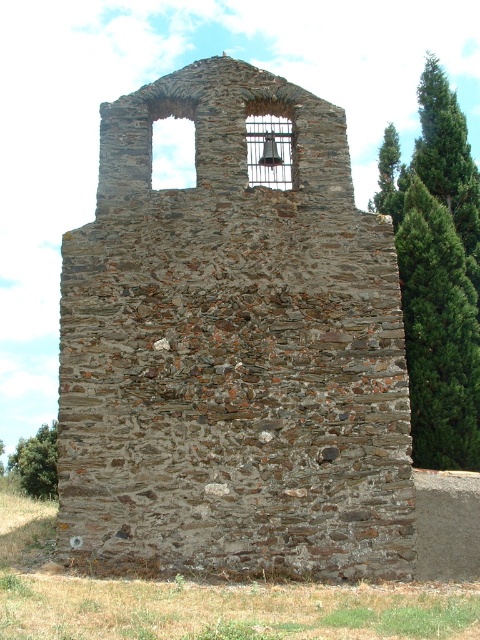
Question: Is green leafy tree at right to the right of metallic bell at upper center from the viewer's perspective?

Choices:
 (A) no
 (B) yes

Answer: (B)

Question: Does metallic bell at upper center have a larger size compared to green textured tree at right?

Choices:
 (A) no
 (B) yes

Answer: (A)

Question: Which point is closer to the camera?

Choices:
 (A) green leafy tree at right
 (B) brown stone bell tower at upper center
 (C) green leafy tree at lower left

Answer: (B)

Question: Estimate the real-world distances between objects in this image. Which object is closer to the green leafy tree at lower left?

Choices:
 (A) green leafy tree at right
 (B) brown stone bell tower at upper center
 (C) green textured tree at right

Answer: (B)

Question: Can you confirm if brown stone bell tower at upper center is positioned to the left of green leafy tree at lower left?

Choices:
 (A) no
 (B) yes

Answer: (A)

Question: Which point is closer to the camera?

Choices:
 (A) (255, 116)
 (B) (382, 168)
 (C) (48, 452)
 (D) (439, 273)

Answer: (A)